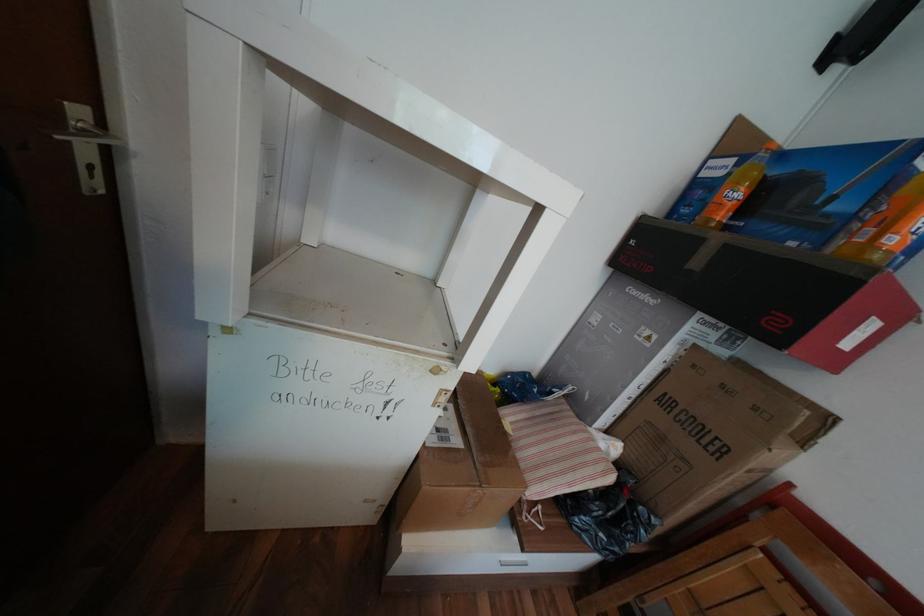
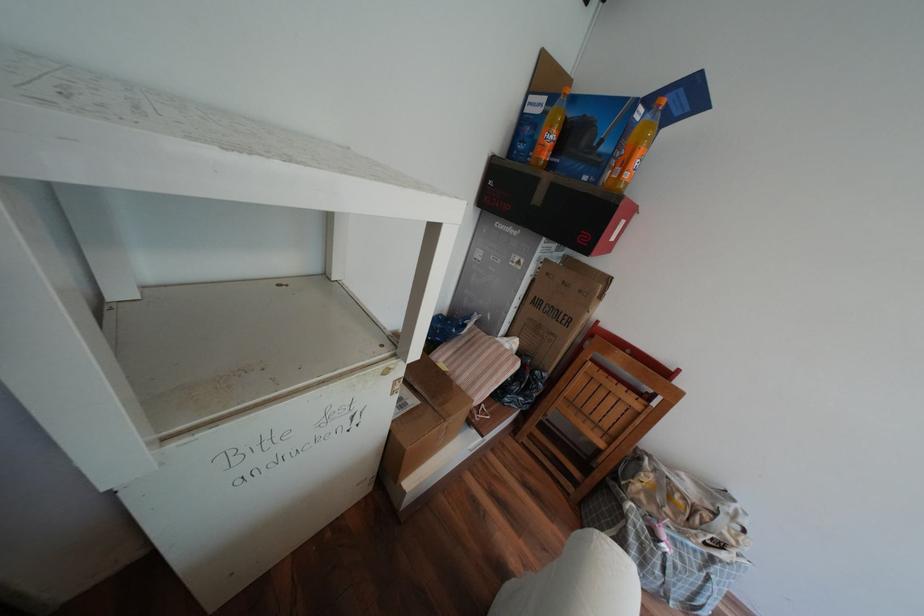
Find the pixel in the second image that matches pixel 467 440 in the first image.

(422, 400)